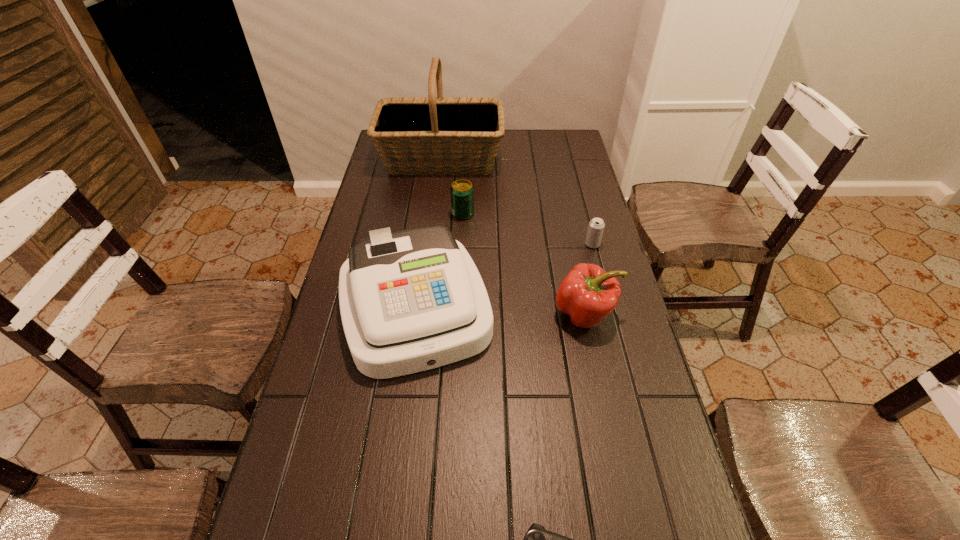
You are a GUI agent. You are given a task and a screenshot of the screen. Output one action in this format:
    pyautogui.click(x=<x>, y=<y>)
    Task: Click on the tallest object
    This screenshot has height=540, width=960.
    Given the screenshot: What is the action you would take?
    pyautogui.click(x=431, y=135)

You are a GUI agent. You are given a task and a screenshot of the screen. Output one action in this format:
    pyautogui.click(x=<x>, y=<y>)
    Task: Click on the basket
    This screenshot has height=540, width=960.
    Given the screenshot: What is the action you would take?
    pyautogui.click(x=431, y=135)

You are a GUI agent. You are given a task and a screenshot of the screen. Output one action in this format:
    pyautogui.click(x=<x>, y=<y>)
    Task: Click on the cash register
    
    Given the screenshot: What is the action you would take?
    pyautogui.click(x=412, y=300)

You are a GUI agent. You are given a task and a screenshot of the screen. Output one action in this format:
    pyautogui.click(x=<x>, y=<y>)
    Task: Click on the pepper
    Image resolution: width=960 pixels, height=540 pixels.
    Given the screenshot: What is the action you would take?
    pyautogui.click(x=587, y=294)

The height and width of the screenshot is (540, 960). I want to click on the fifth nearest object, so click(462, 191).

Find the location of `the left beer can`. the left beer can is located at coordinates pos(462,191).

Where is `the shorter beer can`? This screenshot has height=540, width=960. the shorter beer can is located at coordinates (596, 226).

Locate an element on the screen. The width and height of the screenshot is (960, 540). the nearer beer can is located at coordinates (596, 226).

You are a GUI agent. You are given a task and a screenshot of the screen. Output one action in this format:
    pyautogui.click(x=<x>, y=<y>)
    Task: Click on the vacant space positioned 0.320m by the handle of the basket
    
    Given the screenshot: What is the action you would take?
    pyautogui.click(x=582, y=160)

Identify the location of free location located 0.340m on the back of the cash register. Image resolution: width=960 pixels, height=540 pixels. (431, 191).